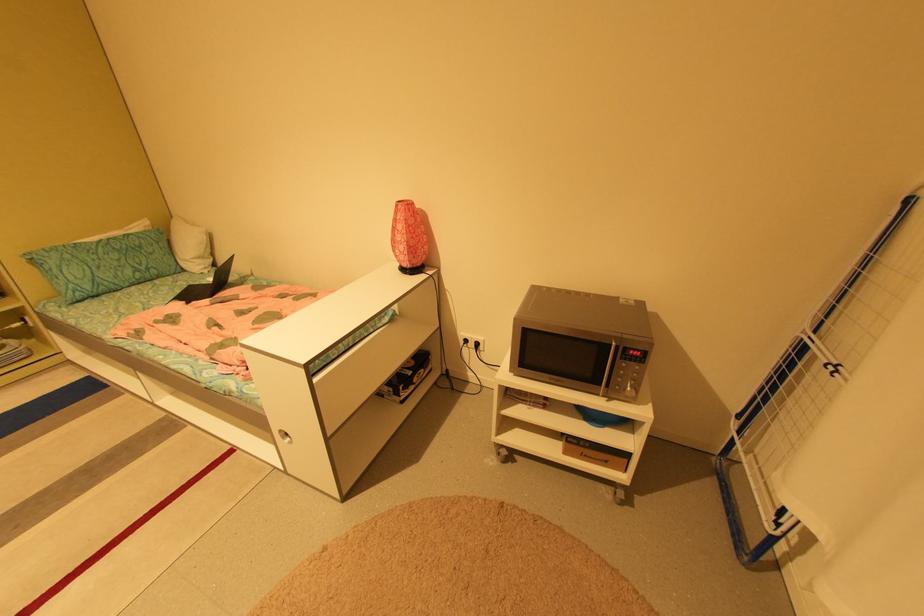
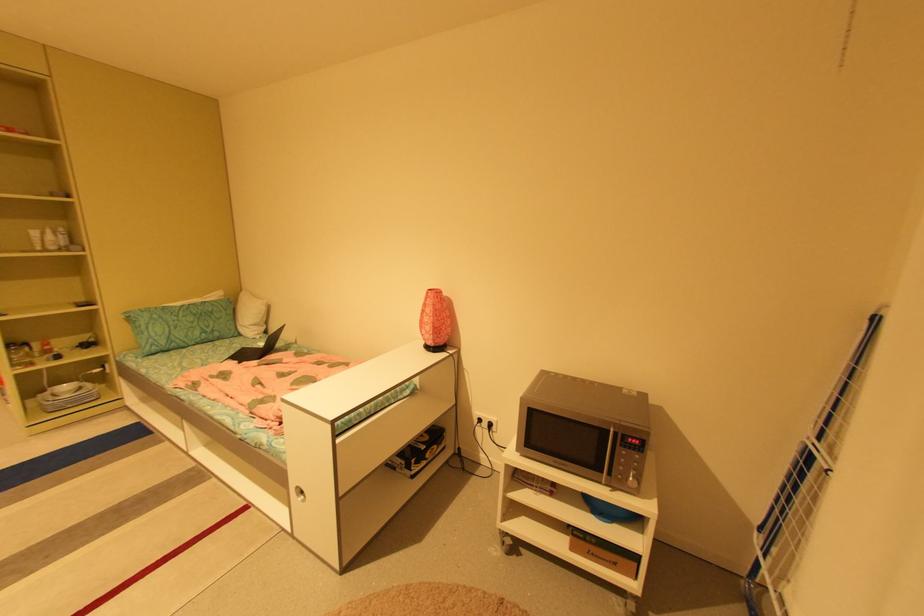
Question: The images are taken continuously from a first-person perspective. In which direction is your viewpoint rotating?

Choices:
 (A) Left
 (B) Right
 (C) Up
 (D) Down

Answer: (C)